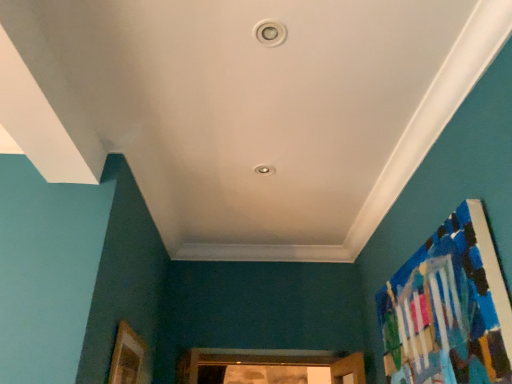
Question: Would you say wooden picture frame at lower left contains painted wood bulletin board at right?

Choices:
 (A) no
 (B) yes

Answer: (A)

Question: Would you consider wooden picture frame at lower left to be distant from painted wood bulletin board at right?

Choices:
 (A) yes
 (B) no

Answer: (A)

Question: Considering the relative sizes of wooden picture frame at lower left and painted wood bulletin board at right in the image provided, is wooden picture frame at lower left smaller than painted wood bulletin board at right?

Choices:
 (A) no
 (B) yes

Answer: (B)

Question: Is wooden picture frame at lower left positioned beyond the bounds of painted wood bulletin board at right?

Choices:
 (A) yes
 (B) no

Answer: (A)

Question: Is wooden picture frame at lower left bigger than painted wood bulletin board at right?

Choices:
 (A) no
 (B) yes

Answer: (A)

Question: Does wooden picture frame at lower left turn towards painted wood bulletin board at right?

Choices:
 (A) no
 (B) yes

Answer: (B)

Question: Is painted wood bulletin board at right facing away from wooden picture frame at lower left?

Choices:
 (A) yes
 (B) no

Answer: (B)

Question: Could wooden picture frame at lower left be considered to be inside painted wood bulletin board at right?

Choices:
 (A) yes
 (B) no

Answer: (B)

Question: Is painted wood bulletin board at right bigger than wooden picture frame at lower left?

Choices:
 (A) no
 (B) yes

Answer: (B)

Question: Is painted wood bulletin board at right behind wooden picture frame at lower left?

Choices:
 (A) no
 (B) yes

Answer: (A)

Question: Is painted wood bulletin board at right thinner than wooden picture frame at lower left?

Choices:
 (A) yes
 (B) no

Answer: (B)

Question: Is painted wood bulletin board at right smaller than wooden picture frame at lower left?

Choices:
 (A) no
 (B) yes

Answer: (A)

Question: Looking at their shapes, would you say wooden picture frame at lower left is wider or thinner than painted wood bulletin board at right?

Choices:
 (A) thin
 (B) wide

Answer: (A)